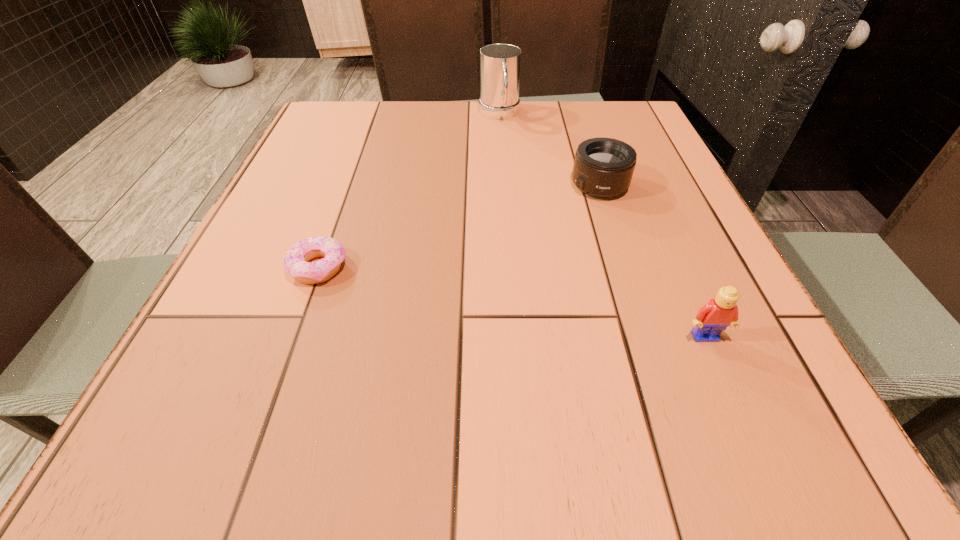
What are the coordinates of `vacant space positioned on the side of the third nearest object with brand markings and control switches` in the screenshot? It's located at (522, 239).

The width and height of the screenshot is (960, 540). I want to click on blank space located 0.180m on the side of the third nearest object with brand markings and control switches, so click(x=529, y=234).

In order to click on vacant point located 0.270m on the side of the farthest object with the handle in this screenshot , I will do `click(516, 185)`.

This screenshot has height=540, width=960. Identify the location of free region located on the side of the farthest object with the handle. (516, 180).

Locate an element on the screen. The height and width of the screenshot is (540, 960). free space located on the side of the farthest object with the handle is located at coordinates (522, 206).

The image size is (960, 540). I want to click on object present at the far edge, so [500, 64].

Locate an element on the screen. The height and width of the screenshot is (540, 960). object that is at the left edge is located at coordinates (295, 263).

At what (x,y) coordinates should I click in order to perform the action: click on Lego at the right edge. Please return your answer as a coordinate pair (x, y). The width and height of the screenshot is (960, 540). Looking at the image, I should click on point(719,313).

The height and width of the screenshot is (540, 960). Find the location of `telephoto lens present at the right edge`. telephoto lens present at the right edge is located at coordinates (603, 167).

In the image, there is a desktop. At what (x,y) coordinates should I click in order to perform the action: click on vacant region at the far edge. Please return your answer as a coordinate pair (x, y). The width and height of the screenshot is (960, 540). Looking at the image, I should click on (451, 117).